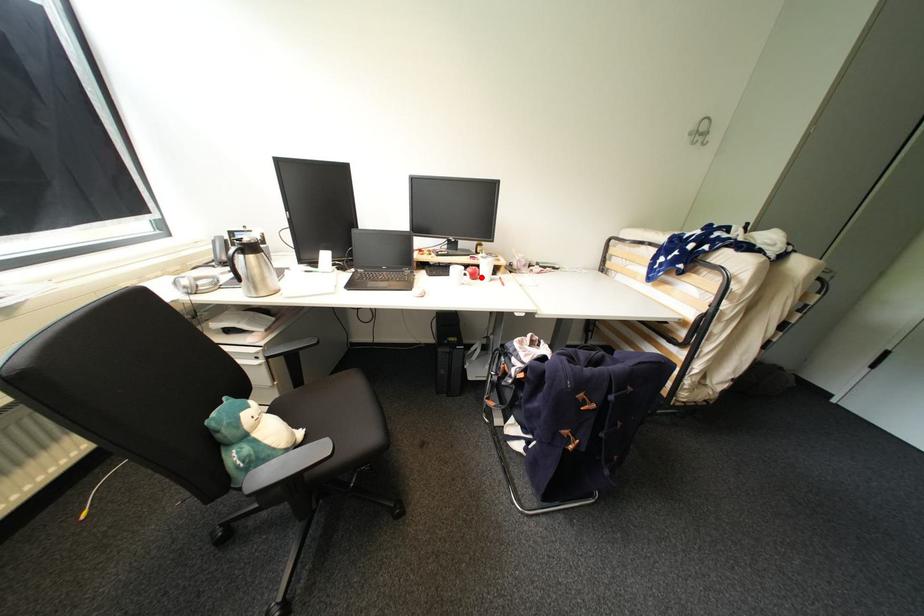
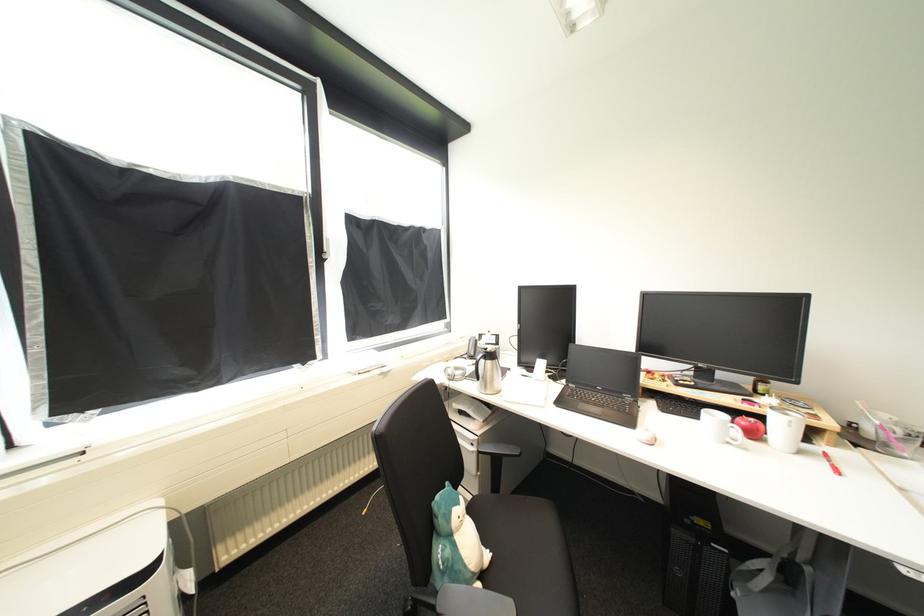
Find the pixel in the second image that matches the highlighted location in the first image.

(761, 436)